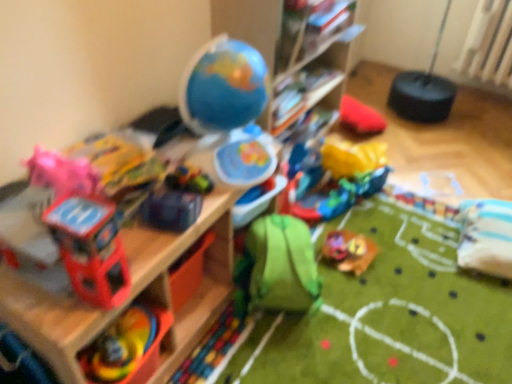
Question: Is green fabric backpack at center, acting as the fourth toy starting from the left, smaller than matte plastic toy helicopter at left, which appears as the fourth toy when viewed from the right?

Choices:
 (A) no
 (B) yes

Answer: (A)

Question: Is green fabric backpack at center, acting as the fourth toy starting from the left, in contact with matte plastic toy helicopter at left, which is counted as the 1th toy, starting from the front?

Choices:
 (A) yes
 (B) no

Answer: (B)

Question: Is there a large distance between green fabric backpack at center, the fourth toy when ordered from front to back, and matte plastic toy helicopter at left, which ranks as the fifth toy in back-to-front order?

Choices:
 (A) no
 (B) yes

Answer: (A)

Question: Can you confirm if green fabric backpack at center, the fourth toy when ordered from front to back, is taller than matte plastic toy helicopter at left, which ranks as the fifth toy in back-to-front order?

Choices:
 (A) no
 (B) yes

Answer: (A)

Question: Considering the relative positions of green fabric backpack at center, which appears as the 2th toy when viewed from the right, and matte plastic toy helicopter at left, which is counted as the 1th toy, starting from the front, in the image provided, is green fabric backpack at center, which appears as the 2th toy when viewed from the right, behind matte plastic toy helicopter at left, which is counted as the 1th toy, starting from the front,?

Choices:
 (A) yes
 (B) no

Answer: (A)

Question: In terms of size, does shiny blue car at center, placed as the third toy when sorted from left to right, appear bigger or smaller than wooden shelf at upper left, which ranks as the 2th shelf in top-to-bottom order?

Choices:
 (A) small
 (B) big

Answer: (A)

Question: In the image, is shiny blue car at center, arranged as the third toy when viewed from the front, on the left side or the right side of wooden shelf at upper left, which is counted as the 1th shelf, starting from the bottom?

Choices:
 (A) left
 (B) right

Answer: (B)

Question: From a real-world perspective, is shiny blue car at center, arranged as the third toy when viewed from the front, above or below wooden shelf at upper left, which is counted as the first shelf, starting from the left?

Choices:
 (A) above
 (B) below

Answer: (A)

Question: In terms of height, does shiny blue car at center, which is counted as the 3th toy, starting from the back, look taller or shorter compared to wooden shelf at upper left, which is counted as the first shelf, starting from the left?

Choices:
 (A) tall
 (B) short

Answer: (B)

Question: Considering the positions of wooden shelf at upper center, acting as the first shelf starting from the top, and shiny blue car at center, placed as the third toy when sorted from left to right, in the image, is wooden shelf at upper center, acting as the first shelf starting from the top, taller or shorter than shiny blue car at center, placed as the third toy when sorted from left to right,?

Choices:
 (A) short
 (B) tall

Answer: (B)

Question: Would you say wooden shelf at upper center, the 2th shelf positioned from the left, is to the left or to the right of shiny blue car at center, which is counted as the 3th toy, starting from the back, in the picture?

Choices:
 (A) left
 (B) right

Answer: (B)

Question: Based on their sizes in the image, would you say wooden shelf at upper center, the 2th shelf positioned from the left, is bigger or smaller than shiny blue car at center, arranged as the third toy when viewed from the front?

Choices:
 (A) big
 (B) small

Answer: (A)

Question: From a real-world perspective, is wooden shelf at upper center, the 2th shelf positioned from the left, physically located above or below shiny blue car at center, placed as the third toy when sorted from left to right?

Choices:
 (A) below
 (B) above

Answer: (B)

Question: Considering the positions of point (485, 62) and point (259, 264), is point (485, 62) closer or farther from the camera than point (259, 264)?

Choices:
 (A) farther
 (B) closer

Answer: (A)

Question: From the image's perspective, is white plastic radiator at upper right above or below green fabric backpack at center, acting as the fourth toy starting from the left?

Choices:
 (A) above
 (B) below

Answer: (A)